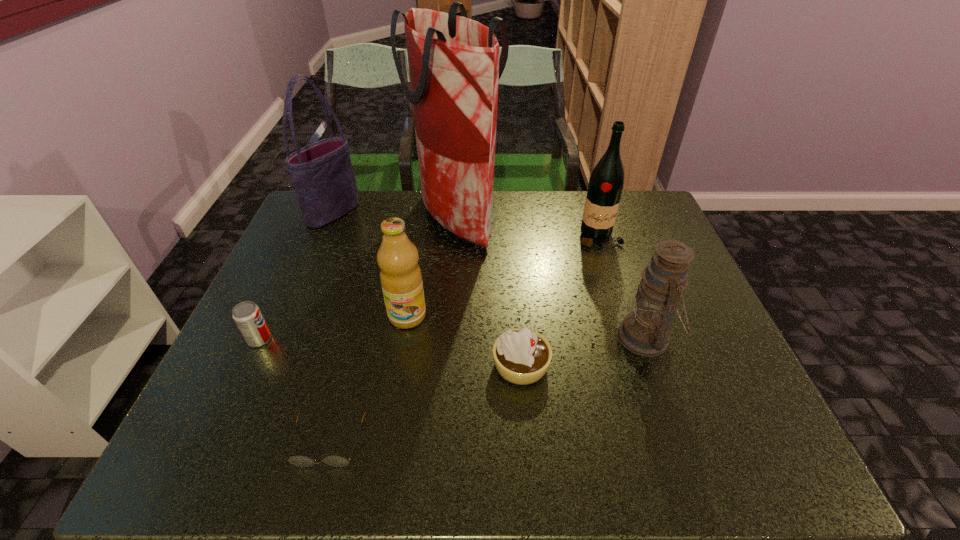
The image size is (960, 540). Identify the location of vacant space at the near left corner of the desktop. (194, 450).

Where is `free space at the far right corner`? free space at the far right corner is located at coordinates (627, 226).

The image size is (960, 540). In the image, there is a desktop. What are the coordinates of `blank space at the near right corner` in the screenshot? It's located at (744, 442).

Find the location of a particular element. empty space between the whipped cream and the spectacles is located at coordinates (425, 403).

What are the coordinates of `vacant area that lies between the whipped cream and the shortest object` in the screenshot? It's located at (425, 403).

I want to click on vacant point located between the olive oil and the soda, so click(x=333, y=327).

The image size is (960, 540). In order to click on vacant space that is in between the spectacles and the whipped cream in this screenshot , I will do `click(425, 403)`.

I want to click on vacant region between the olive oil and the whipped cream, so click(464, 341).

Locate an element on the screen. empty location between the sixth shortest object and the oil lamp is located at coordinates [622, 287].

This screenshot has width=960, height=540. What are the coordinates of `free space between the oil lamp and the whipped cream` in the screenshot? It's located at (584, 351).